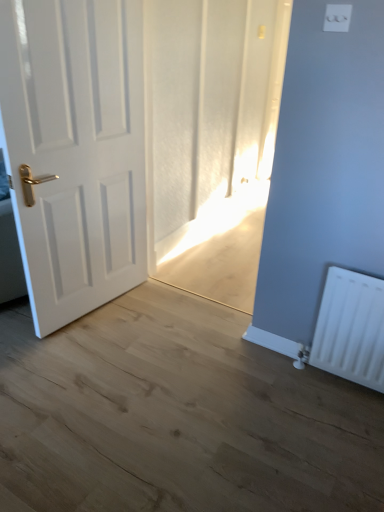
Question: Is point (329, 12) closer or farther from the camera than point (69, 123)?

Choices:
 (A) closer
 (B) farther

Answer: (A)

Question: From the image's perspective, is white plastic light switch at upper center located above or below white matte door at left?

Choices:
 (A) above
 (B) below

Answer: (A)

Question: Which of these objects is positioned farthest from the white plastic radiator at lower right?

Choices:
 (A) white matte door at left
 (B) white plastic light switch at upper center

Answer: (A)

Question: Estimate the real-world distances between objects in this image. Which object is farther from the white plastic light switch at upper center?

Choices:
 (A) white plastic radiator at lower right
 (B) white matte door at left

Answer: (B)